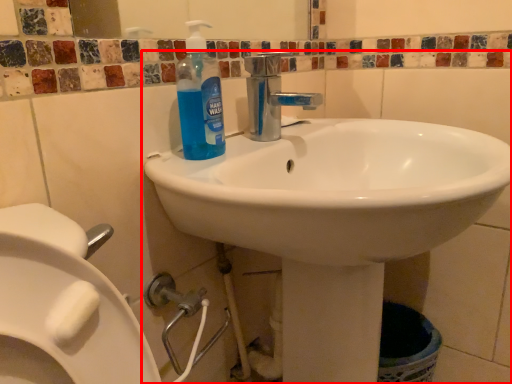
Question: From the image's perspective, where is sink (annotated by the red box) located relative to cleaning product?

Choices:
 (A) below
 (B) above

Answer: (A)